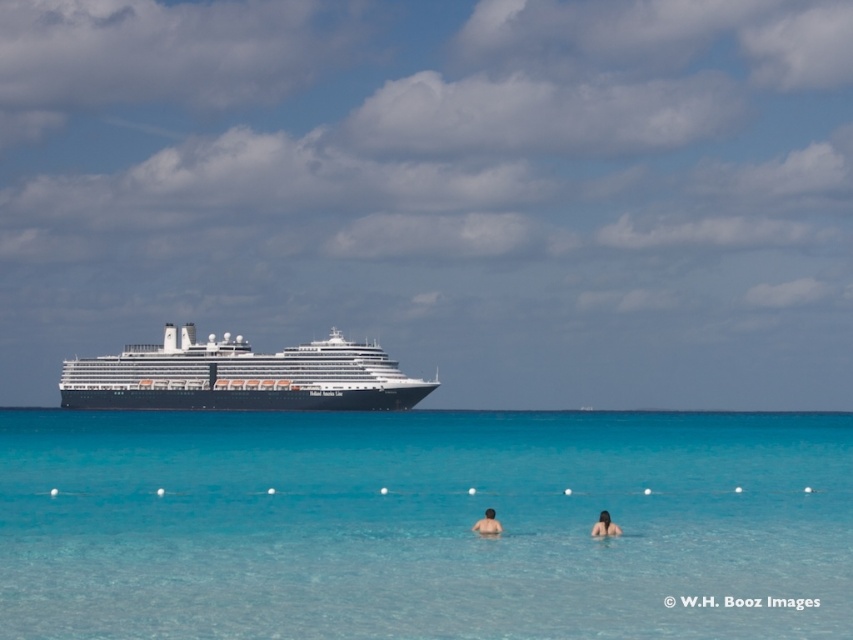
Can you confirm if black glossy cruise ship at center is positioned to the left of dark brown hair at lower center?

Yes, black glossy cruise ship at center is to the left of dark brown hair at lower center.

Can you confirm if black glossy cruise ship at center is positioned below dark brown hair at lower center?

Incorrect, black glossy cruise ship at center is not positioned below dark brown hair at lower center.

Is point (373, 369) less distant than point (618, 534)?

That is False.

The height and width of the screenshot is (640, 853). In order to click on black glossy cruise ship at center in this screenshot , I will do `click(241, 376)`.

Which is below, skinny man at center or dark brown hair at lower center?

skinny man at center is lower down.

Is skinny man at center taller than dark brown hair at lower center?

In fact, skinny man at center may be shorter than dark brown hair at lower center.

Does point (485, 518) lie behind point (602, 509)?

No, (485, 518) is in front of (602, 509).

The width and height of the screenshot is (853, 640). I want to click on skinny man at center, so click(x=486, y=524).

Identify the location of clear blue water at center. (422, 524).

Is clear blue water at center in front of dark brown hair at lower center?

Yes, clear blue water at center is in front of dark brown hair at lower center.

Where is `clear blue water at center`? This screenshot has height=640, width=853. clear blue water at center is located at coordinates (422, 524).